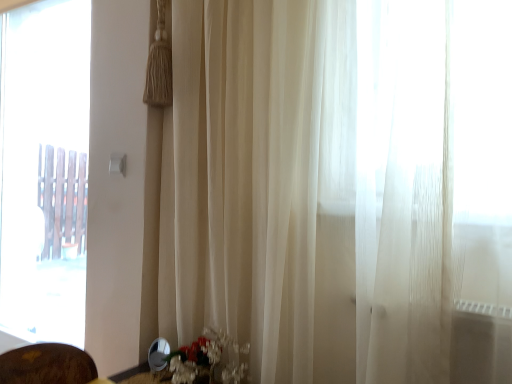
Find the location of `translucent glass vase at lower center`. translucent glass vase at lower center is located at coordinates (202, 355).

The image size is (512, 384). What do you see at coordinates (202, 355) in the screenshot?
I see `translucent glass vase at lower center` at bounding box center [202, 355].

What is the approximate height of translucent glass vase at lower center?

It is 7.33 inches.

Image resolution: width=512 pixels, height=384 pixels. What do you see at coordinates (44, 169) in the screenshot?
I see `transparent glass window at left` at bounding box center [44, 169].

You are a GUI agent. You are given a task and a screenshot of the screen. Output one action in this format:
    pyautogui.click(x=<x>, y=<y>)
    Task: Click on the transparent glass window at left
    
    Given the screenshot: What is the action you would take?
    pyautogui.click(x=44, y=169)

I want to click on translucent glass vase at lower center, so click(x=202, y=355).

Between translucent glass vase at lower center and transparent glass window at left, which one appears on the left side from the viewer's perspective?

transparent glass window at left.

Between translucent glass vase at lower center and transparent glass window at left, which one is positioned in front?

translucent glass vase at lower center is closer to the camera.

Is point (219, 340) closer or farther from the camera than point (80, 114)?

Point (219, 340).

From the image's perspective, is translucent glass vase at lower center on top of transparent glass window at left?

No, from the image's perspective, translucent glass vase at lower center is not above transparent glass window at left.

Looking at this image, from a real-world perspective, between translucent glass vase at lower center and transparent glass window at left, who is vertically lower?

From a 3D spatial view, translucent glass vase at lower center is below.

Which object is wider, translucent glass vase at lower center or transparent glass window at left?

With larger width is translucent glass vase at lower center.

Is translucent glass vase at lower center taller or shorter than transparent glass window at left?

Considering their sizes, translucent glass vase at lower center has less height than transparent glass window at left.

Considering the sizes of objects translucent glass vase at lower center and transparent glass window at left in the image provided, who is smaller, translucent glass vase at lower center or transparent glass window at left?

translucent glass vase at lower center.

Is translucent glass vase at lower center completely or partially outside of transparent glass window at left?

Absolutely, translucent glass vase at lower center is external to transparent glass window at left.

Is translucent glass vase at lower center far away from transparent glass window at left?

Yes, translucent glass vase at lower center is far from transparent glass window at left.

Looking at this image, could you tell me if translucent glass vase at lower center is facing transparent glass window at left?

No, translucent glass vase at lower center is not turned towards transparent glass window at left.

How many degrees apart are the facing directions of translucent glass vase at lower center and transparent glass window at left?

There is a 9.31-degree angle between the facing directions of translucent glass vase at lower center and transparent glass window at left.

This screenshot has height=384, width=512. Identify the location of window above the translucent glass vase at lower center (from the image's perspective). (44, 169).

Does transparent glass window at left appear on the left side of translucent glass vase at lower center?

Correct, you'll find transparent glass window at left to the left of translucent glass vase at lower center.

Is transparent glass window at left positioned behind translucent glass vase at lower center?

Yes, it is.

Considering the points (42, 279) and (229, 374), which point is in front, point (42, 279) or point (229, 374)?

The point (229, 374) is more forward.

From the image's perspective, which is above, transparent glass window at left or translucent glass vase at lower center?

transparent glass window at left.

From a real-world perspective, between transparent glass window at left and translucent glass vase at lower center, who is vertically higher?

transparent glass window at left, from a real-world perspective.

Based on the photo, considering the sizes of objects transparent glass window at left and translucent glass vase at lower center in the image provided, who is thinner, transparent glass window at left or translucent glass vase at lower center?

transparent glass window at left.

Is transparent glass window at left shorter than translucent glass vase at lower center?

Incorrect, the height of transparent glass window at left does not fall short of that of translucent glass vase at lower center.

Looking at the image, does transparent glass window at left seem bigger or smaller compared to translucent glass vase at lower center?

In the image, transparent glass window at left appears to be larger than translucent glass vase at lower center.

Is transparent glass window at left inside the boundaries of translucent glass vase at lower center, or outside?

transparent glass window at left is located beyond the bounds of translucent glass vase at lower center.

Is transparent glass window at left with translucent glass vase at lower center?

They are not placed beside each other.

Could you tell me if transparent glass window at left is turned towards translucent glass vase at lower center?

No, transparent glass window at left is not facing towards translucent glass vase at lower center.

How different are the orientations of transparent glass window at left and translucent glass vase at lower center in degrees?

9.31 degrees.

Find the location of a particular element. The height and width of the screenshot is (384, 512). window that is above the translucent glass vase at lower center (from the image's perspective) is located at coordinates (44, 169).

There is a translucent glass vase at lower center. At what (x,y) coordinates should I click in order to perform the action: click on window above it (from a real-world perspective). Please return your answer as a coordinate pair (x, y). Looking at the image, I should click on (44, 169).

Find the location of a particular element. Image resolution: width=512 pixels, height=384 pixels. floral arrangement on the right of transparent glass window at left is located at coordinates (202, 355).